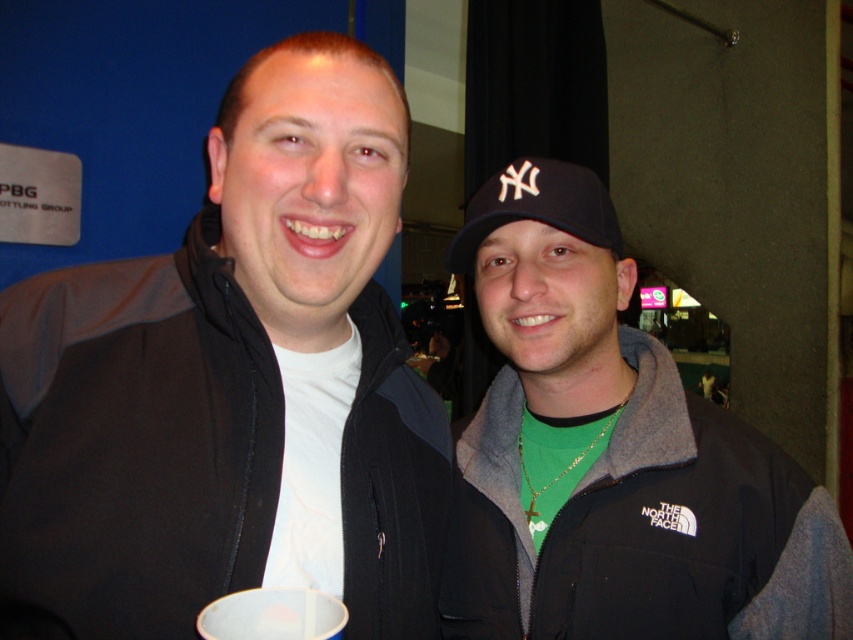
Is point (752, 509) more distant than point (241, 608)?

Yes, point (752, 509) is farther from viewer.

Which is below, black fleece jacket at right or white plastic cup at center?

white plastic cup at center is lower down.

Describe the element at coordinates (645, 529) in the screenshot. This screenshot has width=853, height=640. I see `black fleece jacket at right` at that location.

I want to click on black fleece jacket at right, so click(x=645, y=529).

How far apart are black matte jacket at center and black fleece jacket at right?

black matte jacket at center is 10.95 inches from black fleece jacket at right.

Looking at this image, is black matte jacket at center to the right of black fleece jacket at right from the viewer's perspective?

No, black matte jacket at center is not to the right of black fleece jacket at right.

Where is `black matte jacket at center`? black matte jacket at center is located at coordinates (233, 385).

Identify the location of black matte jacket at center. (233, 385).

Where is `black fabric baseball cap at center`? This screenshot has height=640, width=853. black fabric baseball cap at center is located at coordinates (537, 208).

Does point (468, 202) come farther from viewer compared to point (300, 625)?

Yes, point (468, 202) is behind point (300, 625).

You are a GUI agent. You are given a task and a screenshot of the screen. Output one action in this format:
    pyautogui.click(x=<x>, y=<y>)
    Task: Click on the black fabric baseball cap at center
    Image resolution: width=853 pixels, height=640 pixels.
    Given the screenshot: What is the action you would take?
    pyautogui.click(x=537, y=208)